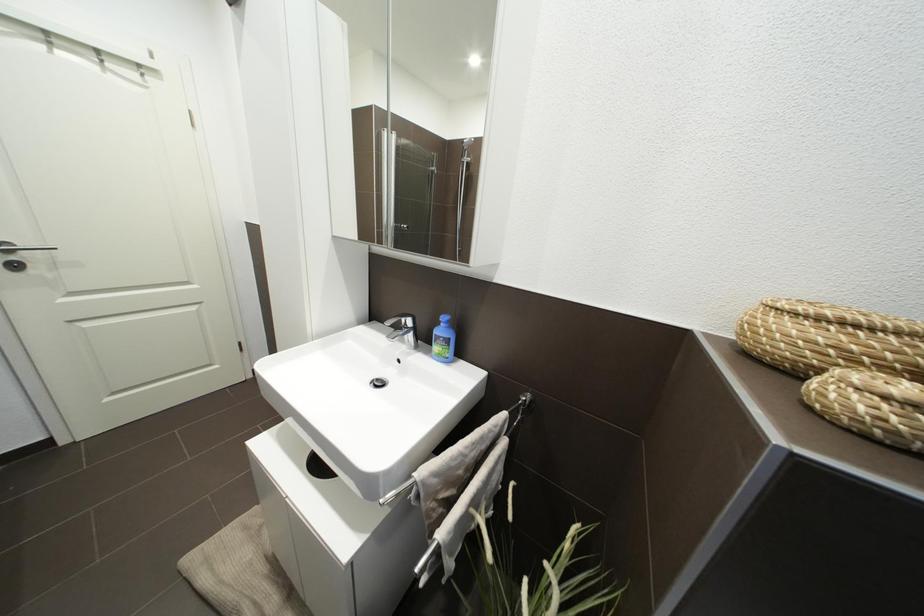
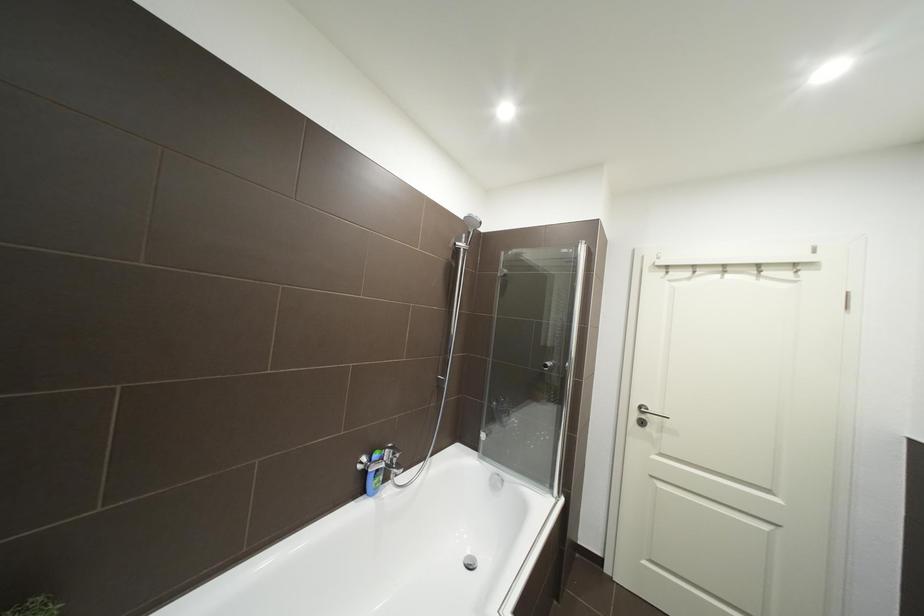
Question: The camera is either moving clockwise (left) or counter-clockwise (right) around the object. The first image is from the beginning of the video and the second image is from the end. Is the camera moving left or right when shooting the video?

Choices:
 (A) Left
 (B) Right

Answer: (B)